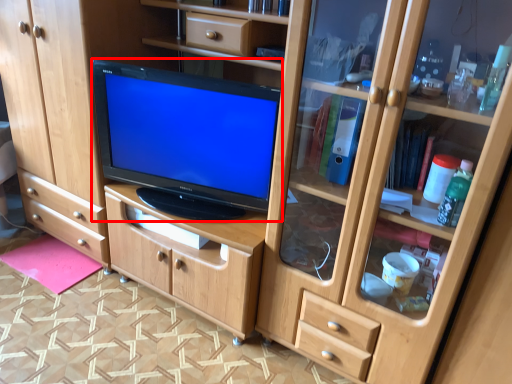
Question: From the image's perspective, where is television (annotated by the red box) located in relation to flat in the image?

Choices:
 (A) below
 (B) above

Answer: (B)